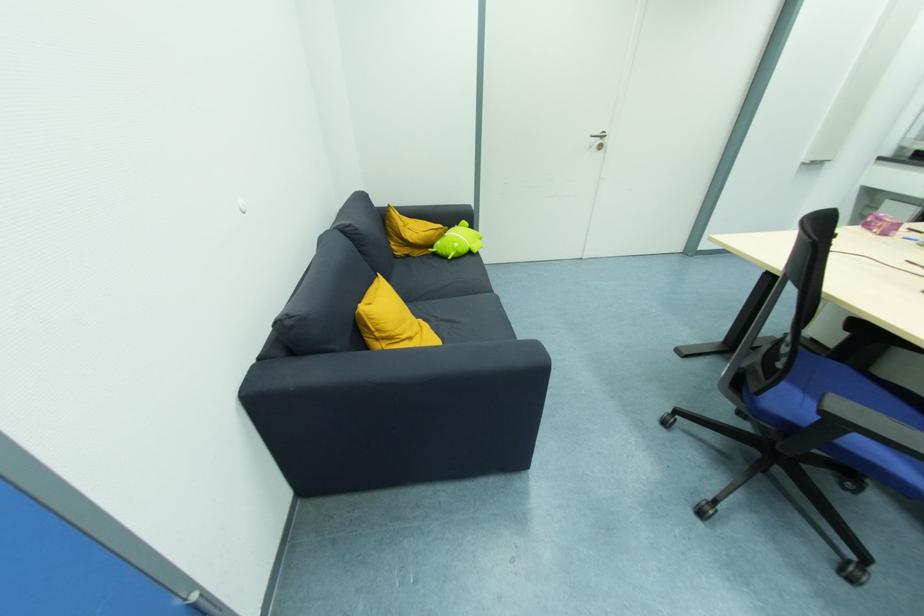
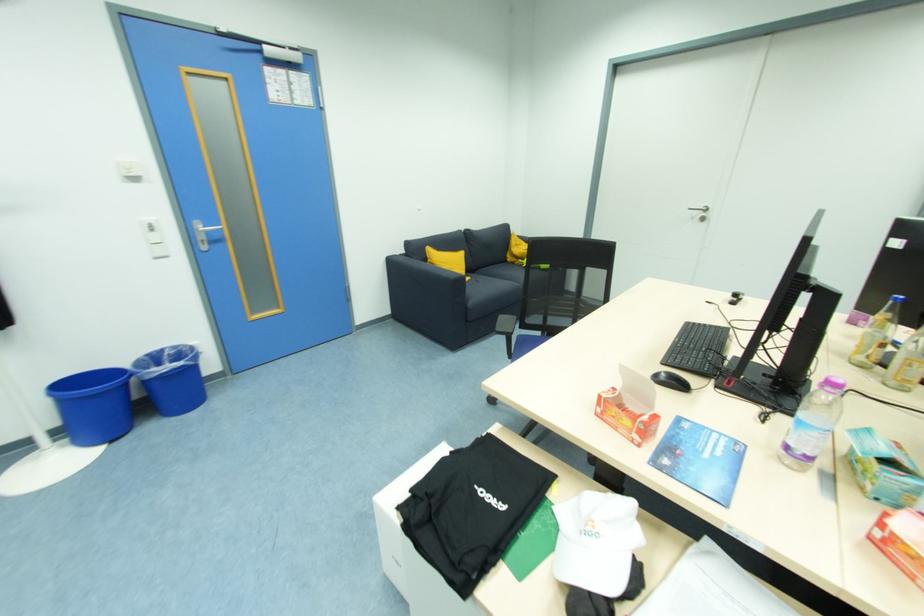
Where in the second image is the point corresponding to the point at 410,257 from the first image?

(516, 265)